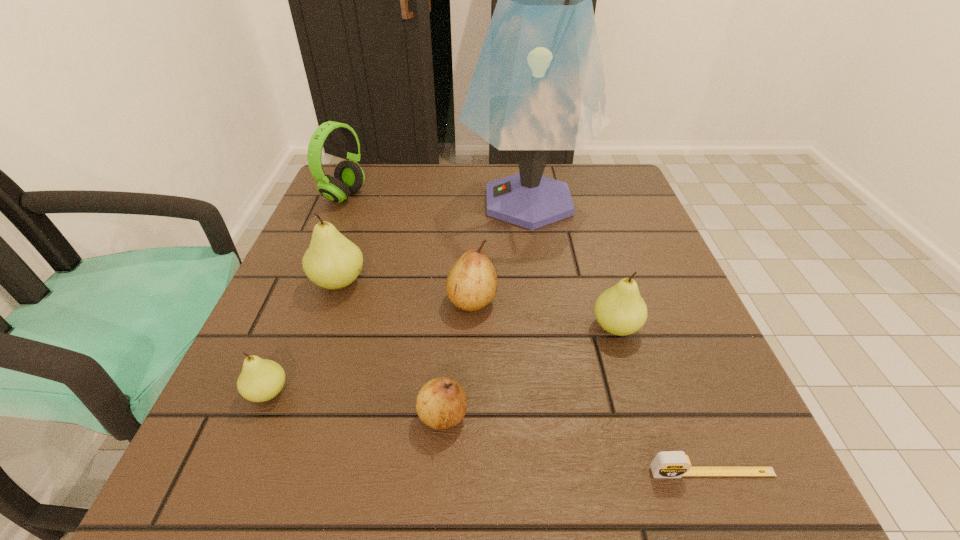
Point out which pear is positioned as the third nearest to the farther brown pear. Please provide its 2D coordinates. Your answer should be formatted as a tuple, i.e. [(x, y)], where the tuple contains the x and y coordinates of a point satisfying the conditions above.

[(620, 310)]

The image size is (960, 540). I want to click on the fifth closest pear relative to the tallest object, so [x=261, y=380].

Locate an element on the screen. green pear that is the closest to the smallest green pear is located at coordinates tap(332, 261).

Identify the location of green pear identified as the closest to the rightmost pear. (332, 261).

The width and height of the screenshot is (960, 540). What are the coordinates of `free space that satisfies the following two spatial constraints: 1. on the back side of the farther brown pear; 2. on the left side of the nearer brown pear` in the screenshot? It's located at (451, 300).

Identify the location of free spot that satisfies the following two spatial constraints: 1. on the front side of the smallest green pear; 2. on the left side of the green headset. (261, 392).

In order to click on free space that satisfies the following two spatial constraints: 1. on the front side of the nearer brown pear; 2. on the right side of the smallest green pear in this screenshot , I will do `click(258, 415)`.

Locate an element on the screen. vacant space that satisfies the following two spatial constraints: 1. on the back side of the nearer brown pear; 2. on the left side of the farther brown pear is located at coordinates (451, 300).

Locate an element on the screen. This screenshot has width=960, height=540. free location that satisfies the following two spatial constraints: 1. on the back side of the bigger brown pear; 2. on the right side of the nearer brown pear is located at coordinates (451, 300).